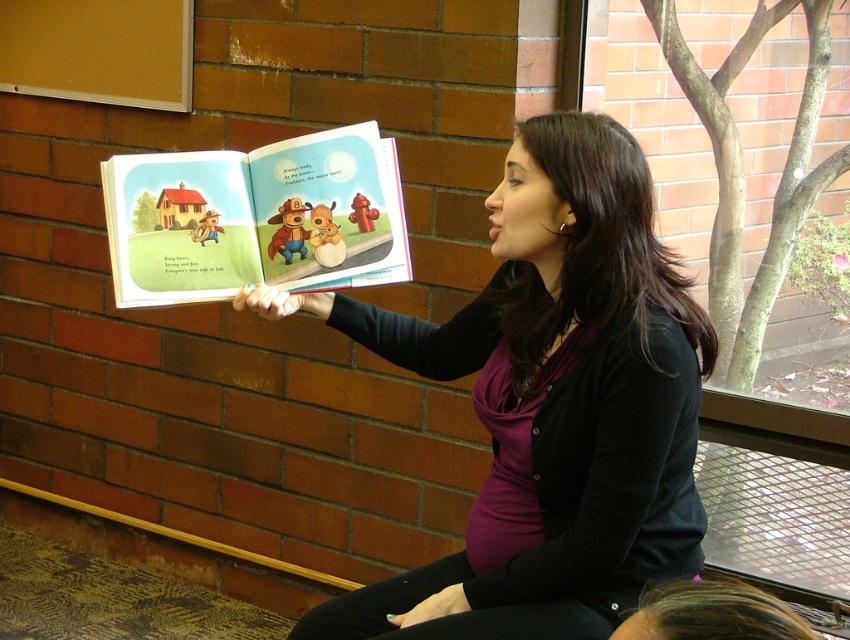
Question: Is matte black sweater at center positioned at the back of matte paper book at center?

Choices:
 (A) yes
 (B) no

Answer: (B)

Question: Is matte black sweater at center below matte paper book at center?

Choices:
 (A) no
 (B) yes

Answer: (B)

Question: Is matte black sweater at center above matte paper book at center?

Choices:
 (A) yes
 (B) no

Answer: (B)

Question: Among these objects, which one is farthest from the camera?

Choices:
 (A) matte black sweater at center
 (B) matte paper book at center

Answer: (B)